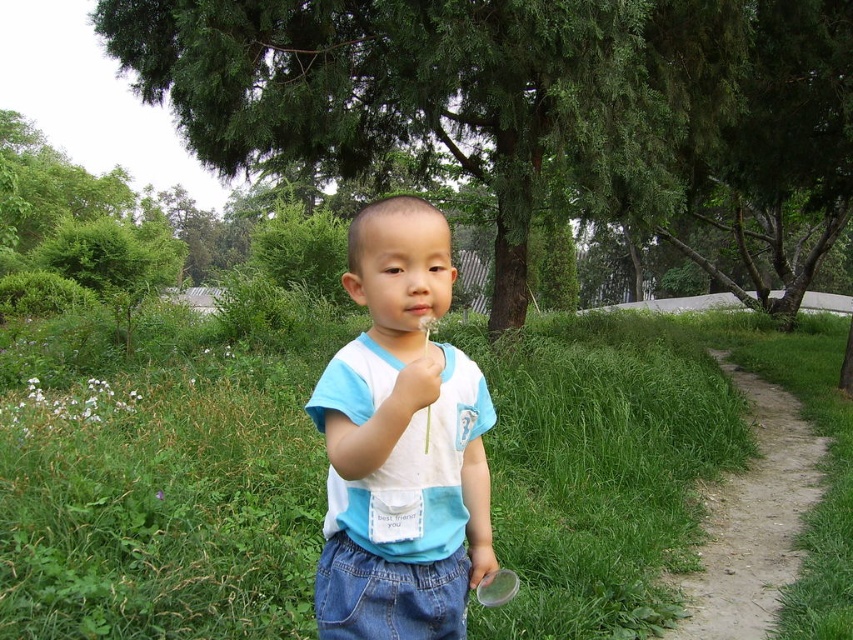
From the picture: You are a hiker who needs to walk along the dirt path at right. You have a white matte hand at center holding a compass. Can your compass fit in your pocket if you place it there?

The dirt path at right has a larger size compared to white matte hand at center, so the compass held by the white matte hand at center would fit in your pocket since the hand is smaller than the path.

In the scene shown: You are a photographer trying to capture the child holding the dandelion and the magnifying glass. Based on the scene, which object occupies a wider area in the image between the green grass at center and the white matte hand at center?

The green grass at center has a larger width than the white matte hand at center, so the green grass at center occupies a wider area in the image.